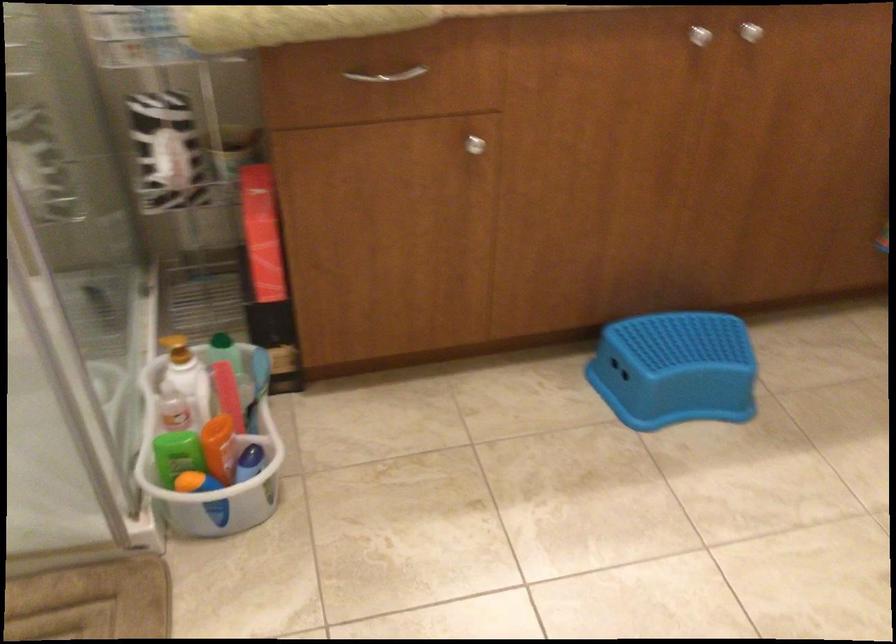
The width and height of the screenshot is (896, 644). What do you see at coordinates (675, 368) in the screenshot?
I see `the blue step stool` at bounding box center [675, 368].